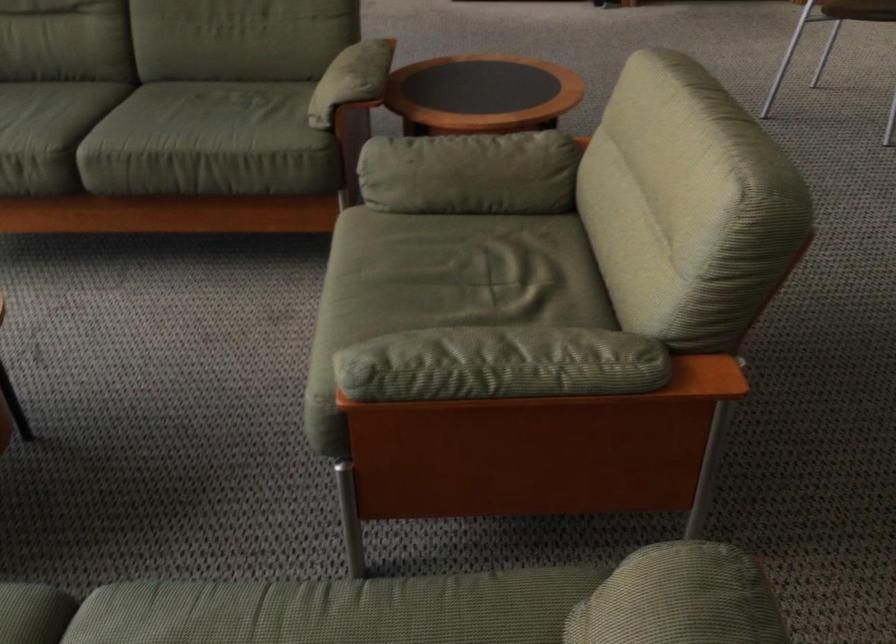
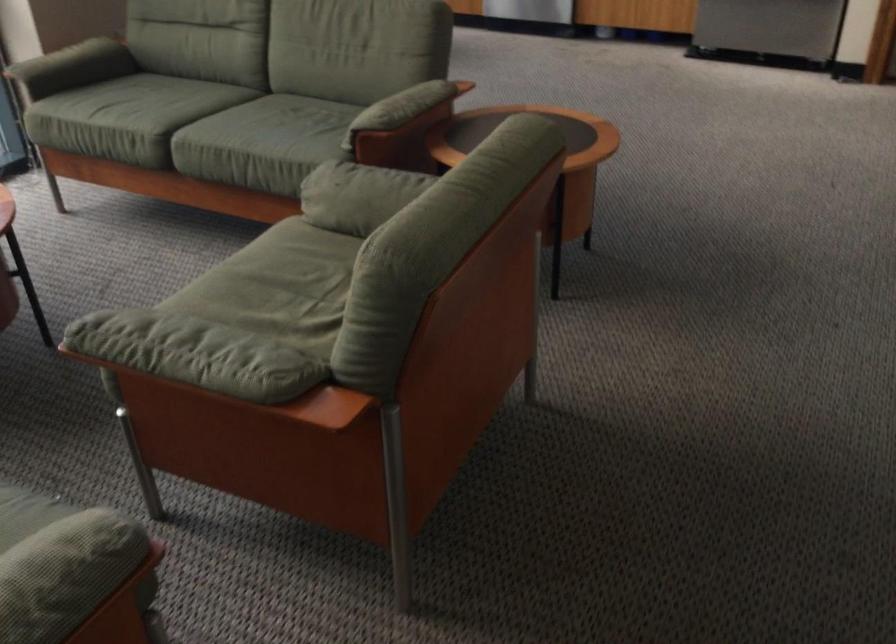
Find the pixel in the second image that matches the point at 412,252 in the first image.

(289, 260)